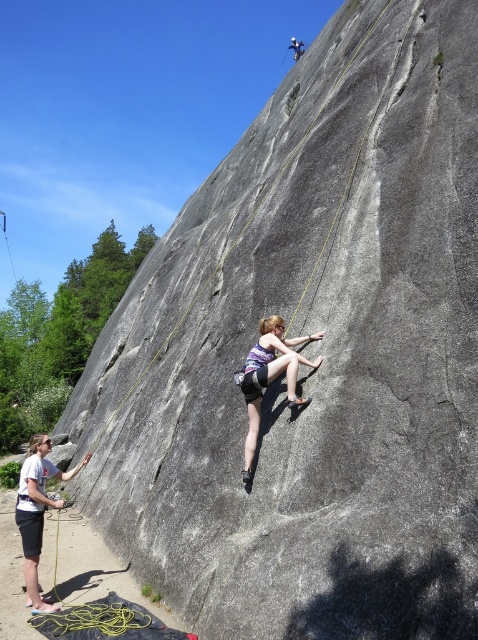
Question: Does white cotton shirt at lower left have a larger size compared to matte gray rock climber at center?

Choices:
 (A) no
 (B) yes

Answer: (A)

Question: Based on their relative distances, which object is nearer to the matte gray rock climber at center?

Choices:
 (A) matte purple tank top at center
 (B) white cotton shirt at lower left

Answer: (A)

Question: Is matte purple tank top at center in front of white cotton shirt at lower left?

Choices:
 (A) yes
 (B) no

Answer: (A)

Question: Which point is farther to the camera?

Choices:
 (A) (23, 504)
 (B) (296, 51)

Answer: (B)

Question: In this image, where is matte purple tank top at center located relative to matte gray rock climber at center?

Choices:
 (A) above
 (B) below

Answer: (B)

Question: Which of these objects is positioned closest to the white cotton shirt at lower left?

Choices:
 (A) matte gray rock climber at center
 (B) matte purple tank top at center

Answer: (B)